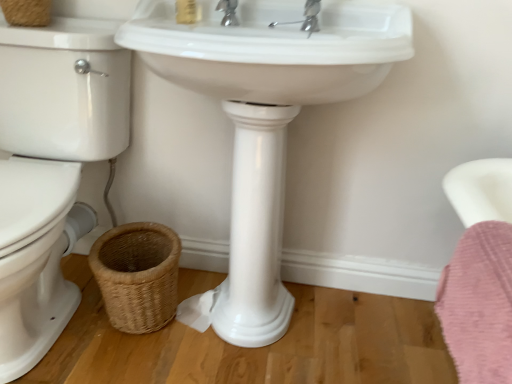
Question: Can you confirm if matte gold soap at upper center is wider than white glossy sink at center?

Choices:
 (A) no
 (B) yes

Answer: (A)

Question: Is matte gold soap at upper center at the right side of white glossy sink at center?

Choices:
 (A) no
 (B) yes

Answer: (A)

Question: Would you say matte gold soap at upper center is a long distance from white glossy sink at center?

Choices:
 (A) yes
 (B) no

Answer: (B)

Question: Is matte gold soap at upper center placed right next to white glossy sink at center?

Choices:
 (A) no
 (B) yes

Answer: (A)

Question: From the image's perspective, is matte gold soap at upper center on top of white glossy sink at center?

Choices:
 (A) yes
 (B) no

Answer: (A)

Question: In the image, is woven natural basket at lower left, the second basket positioned from the top, positioned in front of or behind chrome metallic faucet at upper center?

Choices:
 (A) behind
 (B) front

Answer: (A)

Question: Is woven natural basket at lower left, the 1th basket from the bottom, bigger or smaller than chrome metallic faucet at upper center?

Choices:
 (A) small
 (B) big

Answer: (B)

Question: Would you say woven natural basket at lower left, which is the 2th basket in left-to-right order, is inside or outside chrome metallic faucet at upper center?

Choices:
 (A) outside
 (B) inside

Answer: (A)

Question: Considering the positions of woven natural basket at lower left, the second basket positioned from the top, and chrome metallic faucet at upper center in the image, is woven natural basket at lower left, the second basket positioned from the top, wider or thinner than chrome metallic faucet at upper center?

Choices:
 (A) wide
 (B) thin

Answer: (A)

Question: In terms of size, does woven natural basket at lower left, which is the 2th basket in left-to-right order, appear bigger or smaller than white glossy sink at center?

Choices:
 (A) big
 (B) small

Answer: (B)

Question: Considering the positions of woven natural basket at lower left, which is the 1th basket from right to left, and white glossy sink at center in the image, is woven natural basket at lower left, which is the 1th basket from right to left, taller or shorter than white glossy sink at center?

Choices:
 (A) tall
 (B) short

Answer: (B)

Question: From the image's perspective, is woven natural basket at lower left, which is the 2th basket in left-to-right order, above or below white glossy sink at center?

Choices:
 (A) above
 (B) below

Answer: (B)

Question: Looking at their shapes, would you say woven natural basket at lower left, the second basket positioned from the top, is wider or thinner than white glossy sink at center?

Choices:
 (A) thin
 (B) wide

Answer: (A)

Question: In terms of size, does chrome metallic faucet at upper center appear bigger or smaller than woven natural basket at lower left, which is the 1th basket from right to left?

Choices:
 (A) big
 (B) small

Answer: (B)

Question: Considering the positions of point (218, 6) and point (114, 231), is point (218, 6) closer or farther from the camera than point (114, 231)?

Choices:
 (A) farther
 (B) closer

Answer: (B)